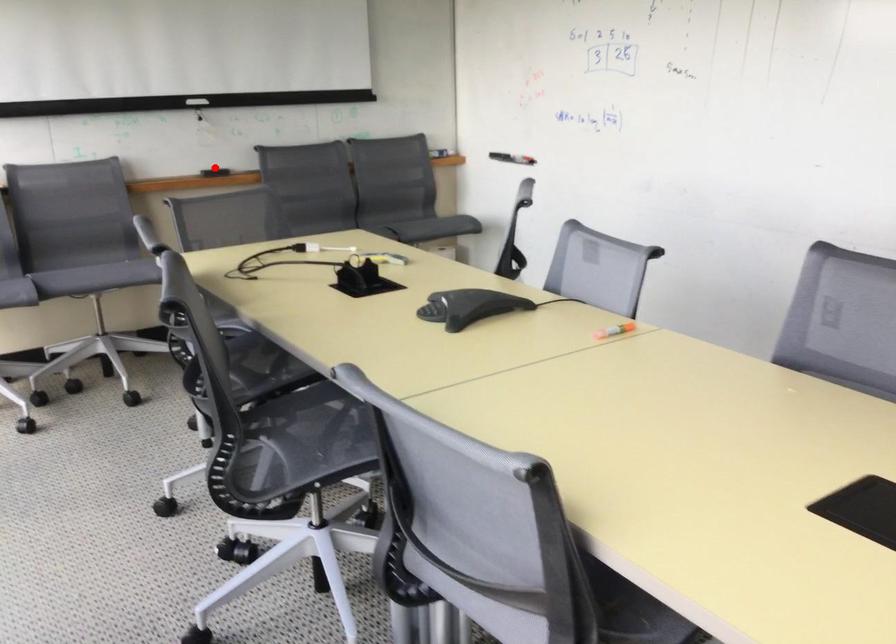
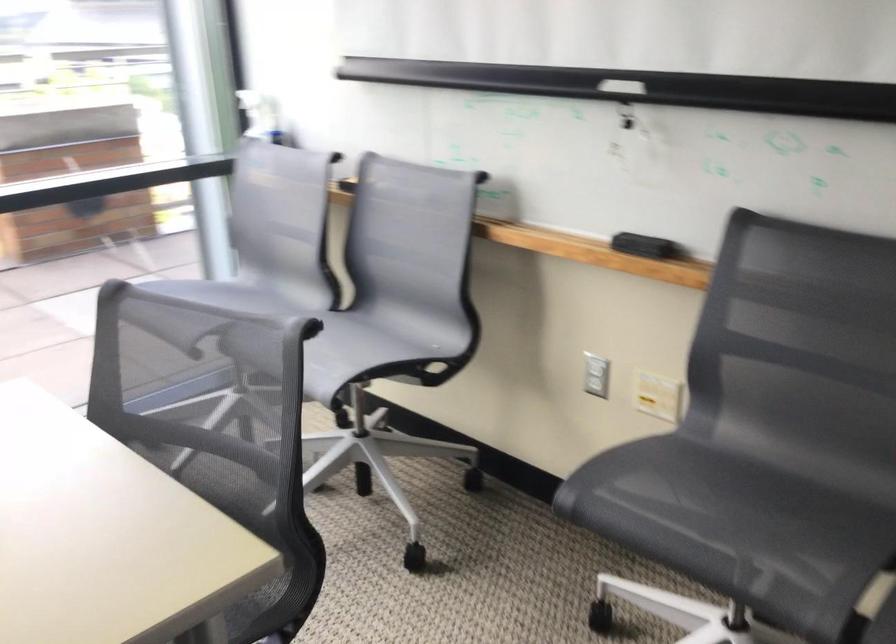
Question: I am providing you with two images of the same scene from different viewpoints. Image1 has a red point marked. In image2, the corresponding 3D location appears at what relative position? Reply with the corresponding letter.

Choices:
 (A) Closer
 (B) Farther

Answer: (A)